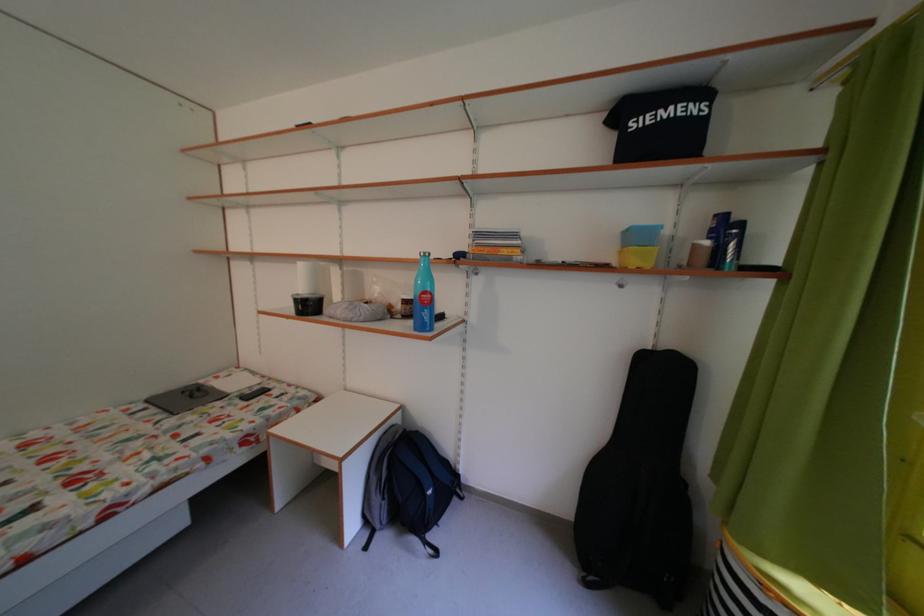
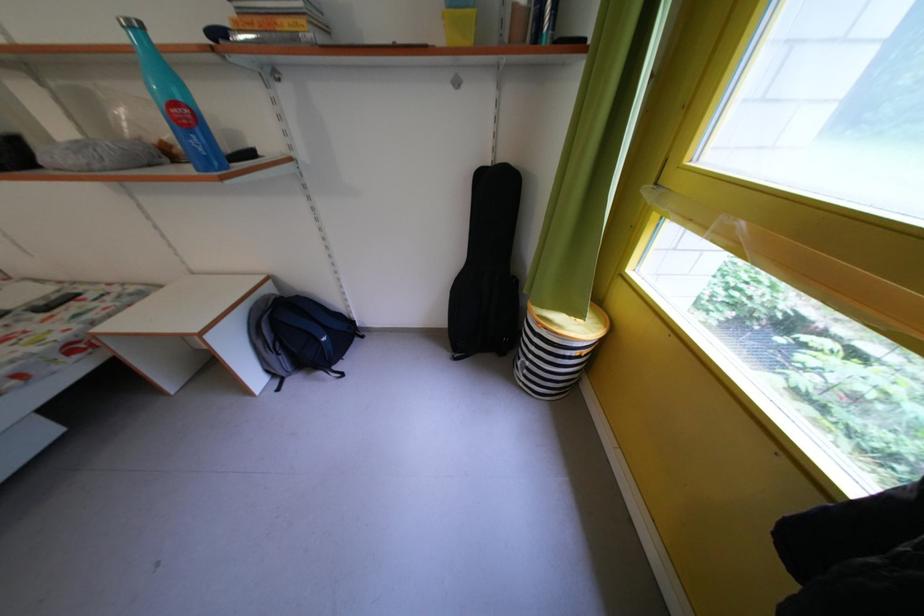
The point at [661,354] is marked in the first image. Where is the corresponding point in the second image?

(499, 171)